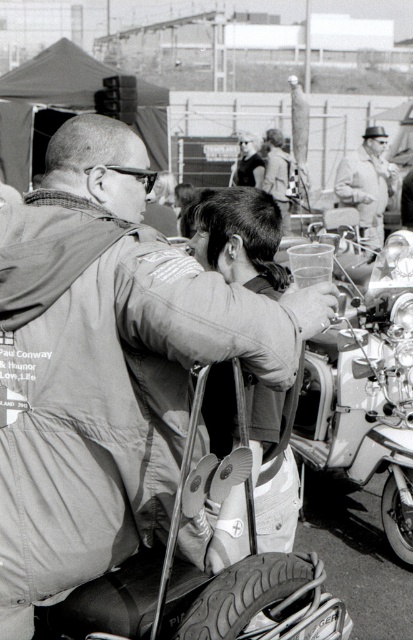
You are standing in front of this photograph and notice two points marked in the scene. The first point is at coordinates point (x=159, y=248) and the second is at point (x=412, y=508). Which of these points is nearer to you?

Point (x=159, y=248) is closer to the viewer than point (x=412, y=508).